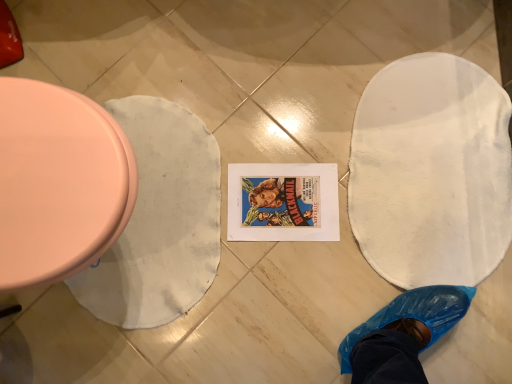
Where is `free space to the back side of matte pink toilet at left`? Image resolution: width=512 pixels, height=384 pixels. free space to the back side of matte pink toilet at left is located at coordinates (113, 52).